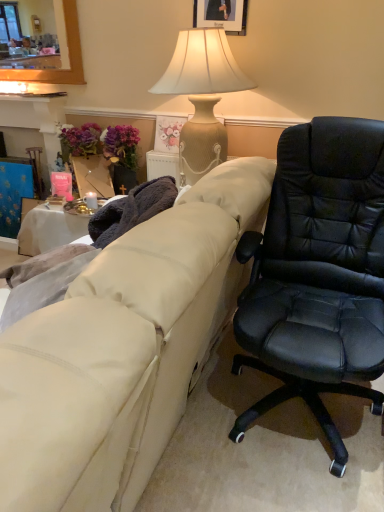
Question: Is wooden picture frame at upper center facing away from beige textured lamp at upper center?

Choices:
 (A) no
 (B) yes

Answer: (A)

Question: From the image's perspective, is wooden picture frame at upper center located above beige textured lamp at upper center?

Choices:
 (A) no
 (B) yes

Answer: (B)

Question: Does wooden picture frame at upper center appear on the right side of beige textured lamp at upper center?

Choices:
 (A) yes
 (B) no

Answer: (A)

Question: Can beige textured lamp at upper center be found inside wooden picture frame at upper center?

Choices:
 (A) yes
 (B) no

Answer: (B)

Question: From a real-world perspective, is wooden picture frame at upper center beneath beige textured lamp at upper center?

Choices:
 (A) no
 (B) yes

Answer: (A)

Question: Are wooden picture frame at upper center and beige textured lamp at upper center beside each other?

Choices:
 (A) yes
 (B) no

Answer: (B)

Question: From the image's perspective, does purple fabric at left appear lower than beige textured lamp at upper center?

Choices:
 (A) no
 (B) yes

Answer: (B)

Question: Can you confirm if purple fabric at left is taller than beige textured lamp at upper center?

Choices:
 (A) yes
 (B) no

Answer: (B)

Question: Is purple fabric at left placed right next to beige textured lamp at upper center?

Choices:
 (A) yes
 (B) no

Answer: (B)

Question: Could you tell me if purple fabric at left is turned towards beige textured lamp at upper center?

Choices:
 (A) no
 (B) yes

Answer: (A)

Question: Can you confirm if purple fabric at left is bigger than beige textured lamp at upper center?

Choices:
 (A) yes
 (B) no

Answer: (B)

Question: Considering the relative sizes of purple fabric at left and beige textured lamp at upper center in the image provided, is purple fabric at left shorter than beige textured lamp at upper center?

Choices:
 (A) yes
 (B) no

Answer: (A)

Question: Considering the relative positions of wooden picture frame at upper center and beige fabric couch at center in the image provided, is wooden picture frame at upper center behind beige fabric couch at center?

Choices:
 (A) yes
 (B) no

Answer: (A)